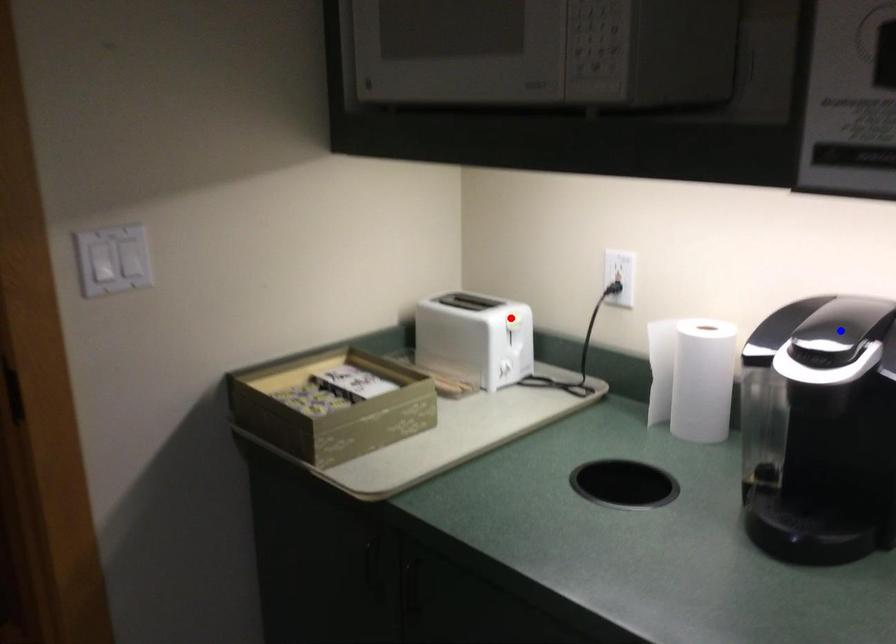
Question: Which of the two points in the image is closer to the camera?

Choices:
 (A) Blue point is closer.
 (B) Red point is closer.

Answer: (A)